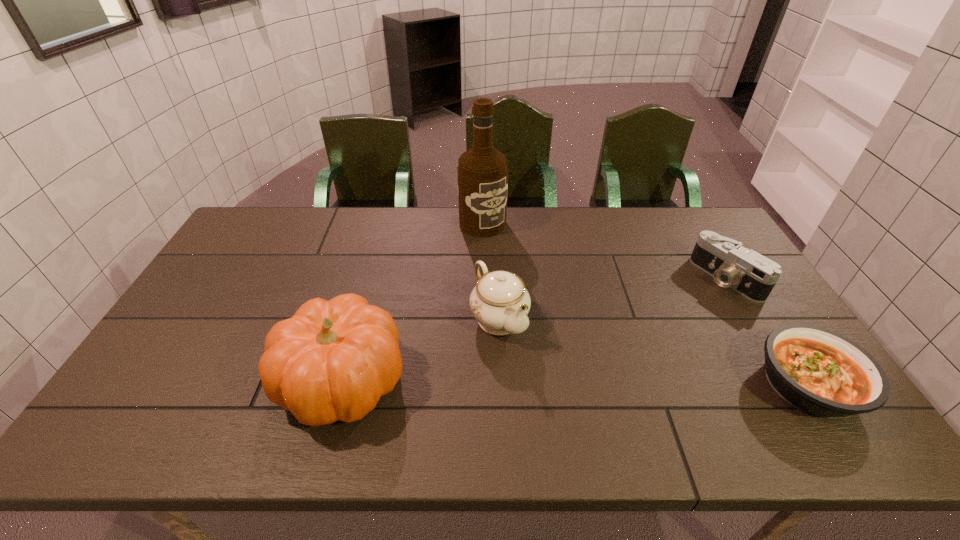
This screenshot has width=960, height=540. Identify the location of vacant point located between the tallest object and the second shortest object. (605, 251).

The width and height of the screenshot is (960, 540). Identify the location of unoccupied position between the second shortest object and the leftmost object. (534, 329).

Locate an element on the screen. empty location between the chinaware and the fourth shortest object is located at coordinates (420, 349).

This screenshot has width=960, height=540. What are the coordinates of `vacant space in between the shortest object and the third shortest object` in the screenshot? It's located at (654, 352).

Locate an element on the screen. The height and width of the screenshot is (540, 960). empty space that is in between the fourth shortest object and the second shortest object is located at coordinates (534, 329).

Find the location of `free space between the fourth shortest object and the alcohol`. free space between the fourth shortest object and the alcohol is located at coordinates (412, 302).

This screenshot has height=540, width=960. Find the location of `empty space between the pumpkin and the second shortest object`. empty space between the pumpkin and the second shortest object is located at coordinates (534, 329).

This screenshot has width=960, height=540. Identify the location of blank region between the shortest object and the farthest object. (645, 305).

At what (x,y) coordinates should I click in order to perform the action: click on the fourth closest object to the farthest object. Please return your answer as a coordinate pair (x, y). Looking at the image, I should click on (818, 371).

This screenshot has height=540, width=960. Find the location of `the third closest object to the third shortest object`. the third closest object to the third shortest object is located at coordinates (818, 371).